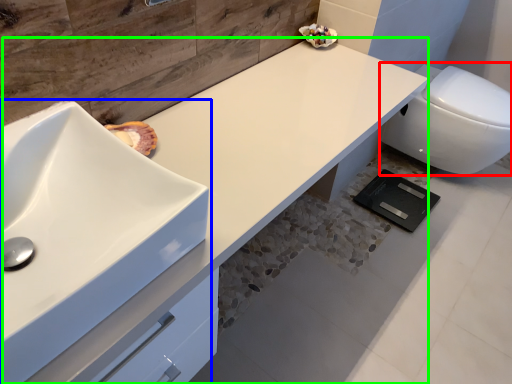
Question: Considering the real-world distances, which object is farthest from toilet (highlighted by a red box)? sink (highlighted by a blue box) or counter top (highlighted by a green box)?

Choices:
 (A) sink
 (B) counter top

Answer: (A)